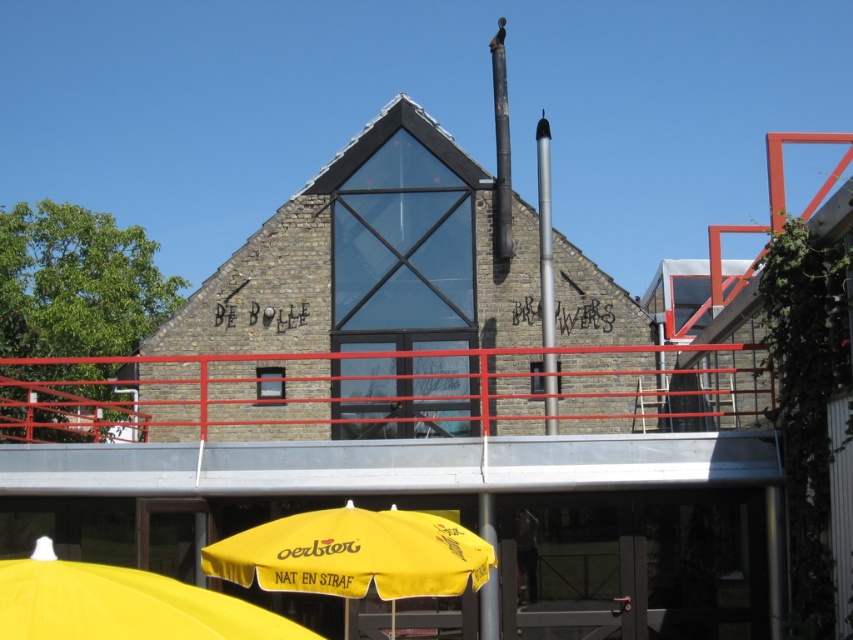
Is red metal railing at center positioned at the back of yellow fabric umbrella at lower center?

Yes, red metal railing at center is further from the viewer.

Which is above, red metal railing at center or yellow fabric umbrella at lower center?

red metal railing at center is above.

Is point (311, 355) farther from viewer compared to point (402, 524)?

That is True.

Identify the location of red metal railing at center. (346, 394).

I want to click on red metal railing at center, so click(346, 394).

Is red metal railing at center taller than yellow fabric umbrella at lower left?

Yes, red metal railing at center is taller than yellow fabric umbrella at lower left.

Does point (321, 369) come in front of point (73, 600)?

That is False.

This screenshot has height=640, width=853. I want to click on red metal railing at center, so click(x=346, y=394).

Is yellow fabric umbrella at lower center positioned before yellow fabric umbrella at lower left?

That is False.

Is yellow fabric umbrella at lower center to the right of yellow fabric umbrella at lower left from the viewer's perspective?

Correct, you'll find yellow fabric umbrella at lower center to the right of yellow fabric umbrella at lower left.

Who is more forward, (x=410, y=556) or (x=289, y=627)?

Point (x=289, y=627)

You are a GUI agent. You are given a task and a screenshot of the screen. Output one action in this format:
    pyautogui.click(x=<x>, y=<y>)
    Task: Click on the yellow fabric umbrella at lower center
    The height and width of the screenshot is (640, 853).
    Given the screenshot: What is the action you would take?
    [x=354, y=556]